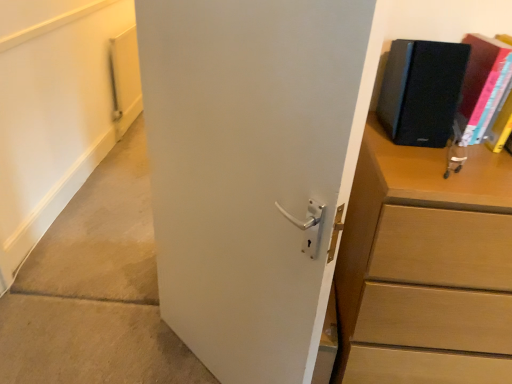
The image size is (512, 384). Find the location of `free space in front of black matte speaker at upper right, which is the first paperback book from left to right`. free space in front of black matte speaker at upper right, which is the first paperback book from left to right is located at coordinates coord(432,160).